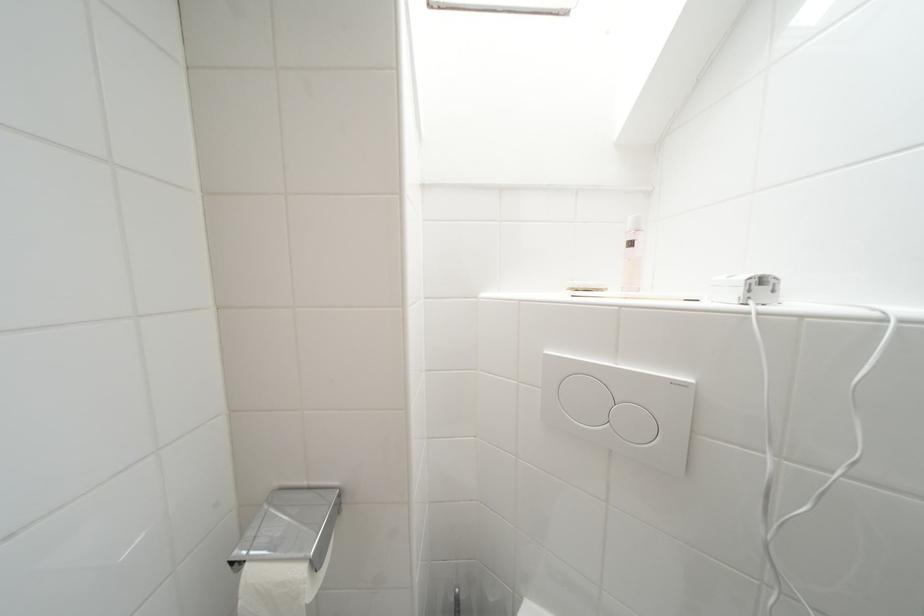
Identify the location of large toilet flush button. The image size is (924, 616). (584, 399).